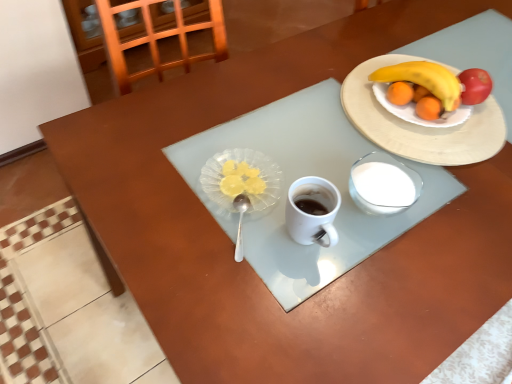
Question: Is translucent glass plate at center oriented away from yellow matte banana at upper right?

Choices:
 (A) no
 (B) yes

Answer: (A)

Question: Are translucent glass plate at center and yellow matte banana at upper right beside each other?

Choices:
 (A) yes
 (B) no

Answer: (B)

Question: Is translucent glass plate at center behind yellow matte banana at upper right?

Choices:
 (A) no
 (B) yes

Answer: (A)

Question: Does translucent glass plate at center turn towards yellow matte banana at upper right?

Choices:
 (A) no
 (B) yes

Answer: (A)

Question: Does translucent glass plate at center have a lesser width compared to yellow matte banana at upper right?

Choices:
 (A) no
 (B) yes

Answer: (B)

Question: Considering the relative sizes of translucent glass plate at center and yellow matte banana at upper right in the image provided, is translucent glass plate at center smaller than yellow matte banana at upper right?

Choices:
 (A) no
 (B) yes

Answer: (B)

Question: From a real-world perspective, is yellow matte banana at upper right positioned under translucent glass plate at center based on gravity?

Choices:
 (A) no
 (B) yes

Answer: (B)

Question: From the image's perspective, is yellow matte banana at upper right located above translucent glass plate at center?

Choices:
 (A) yes
 (B) no

Answer: (A)

Question: Does yellow matte banana at upper right appear on the right side of translucent glass plate at center?

Choices:
 (A) yes
 (B) no

Answer: (A)

Question: Does yellow matte banana at upper right have a larger size compared to translucent glass plate at center?

Choices:
 (A) no
 (B) yes

Answer: (B)

Question: Does yellow matte banana at upper right turn towards translucent glass plate at center?

Choices:
 (A) yes
 (B) no

Answer: (B)

Question: Does yellow matte banana at upper right have a lesser width compared to translucent glass plate at center?

Choices:
 (A) yes
 (B) no

Answer: (B)

Question: Is white ceramic plate at upper right facing away from yellow matte banana at upper right?

Choices:
 (A) no
 (B) yes

Answer: (B)